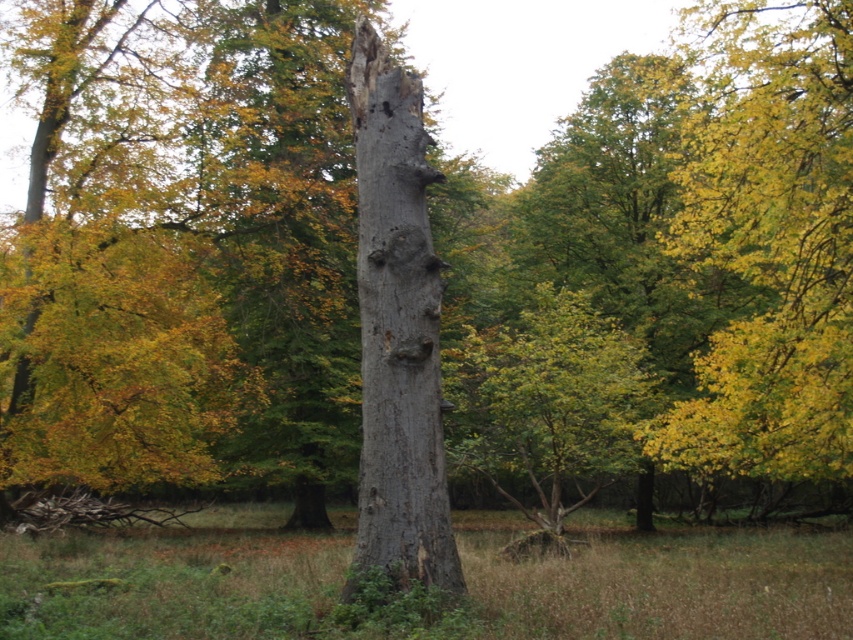
Question: Which point is farther to the camera?

Choices:
 (A) gray rough bark tree trunk at center
 (B) smooth gray bark at center
 (C) yellow-green leaves at upper right

Answer: (B)

Question: Is yellow-green leaves at upper right above smooth gray bark at center?

Choices:
 (A) no
 (B) yes

Answer: (B)

Question: Is yellow-green leaves at upper right closer to the viewer compared to smooth gray bark at center?

Choices:
 (A) yes
 (B) no

Answer: (A)

Question: Does gray rough bark tree trunk at center have a larger size compared to smooth gray bark at center?

Choices:
 (A) yes
 (B) no

Answer: (B)

Question: Which point is farther to the camera?

Choices:
 (A) (381, 128)
 (B) (804, 51)

Answer: (B)

Question: Which point appears closest to the camera in this image?

Choices:
 (A) (538, 403)
 (B) (827, 200)

Answer: (B)